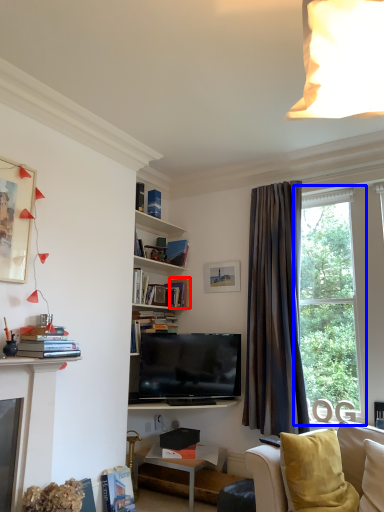
Question: Which object is closer to the camera taking this photo, book (highlighted by a red box) or window (highlighted by a blue box)?

Choices:
 (A) book
 (B) window

Answer: (B)